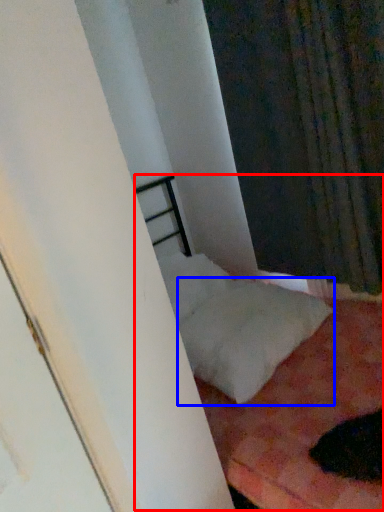
Question: Which of the following is the closest to the observer, bed (highlighted by a red box) or pillow (highlighted by a blue box)?

Choices:
 (A) bed
 (B) pillow

Answer: (A)